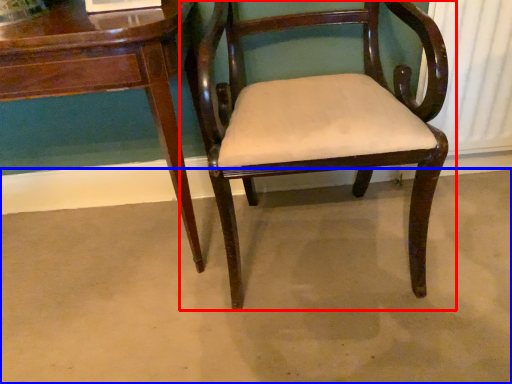
Question: Which object appears farthest to the camera in this image, chair (highlighted by a red box) or concrete (highlighted by a blue box)?

Choices:
 (A) chair
 (B) concrete

Answer: (B)